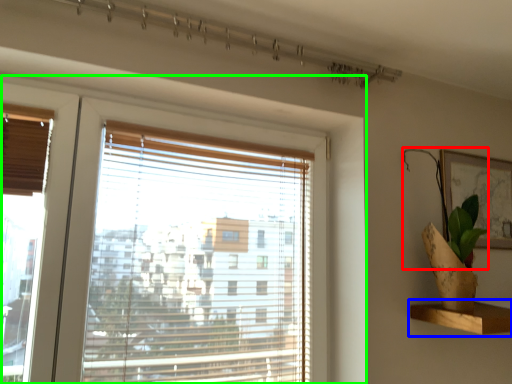
Question: Based on their relative distances, which object is nearer to plant (highlighted by a red box)? Choose from shelf (highlighted by a blue box) and window (highlighted by a green box).

Choices:
 (A) shelf
 (B) window

Answer: (A)